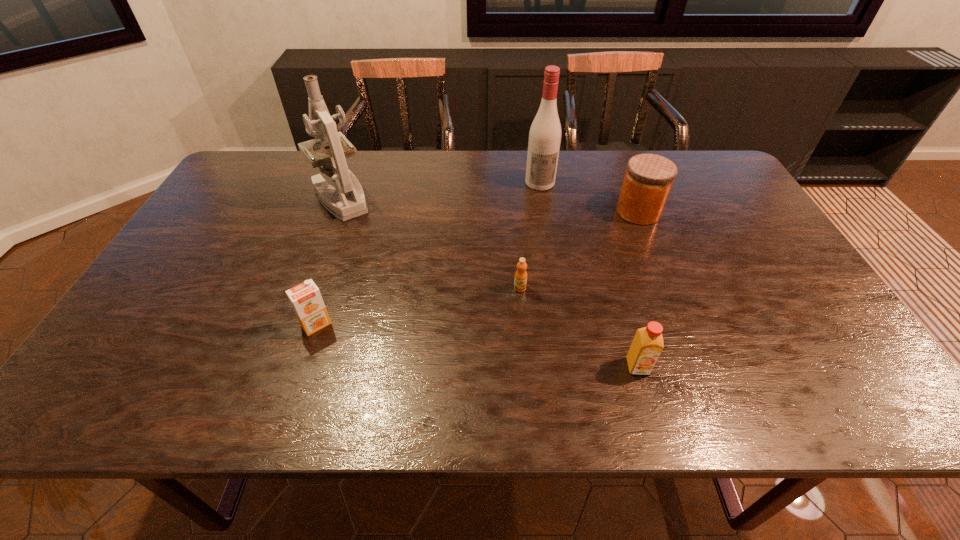
Locate an element on the screen. The width and height of the screenshot is (960, 540). microscope is located at coordinates click(x=347, y=200).

Image resolution: width=960 pixels, height=540 pixels. I want to click on alcohol, so click(545, 132).

Identify the location of the rightmost object. (648, 180).

Where is `the nearest orange juice`? the nearest orange juice is located at coordinates (647, 345).

You are a GUI agent. You are given a task and a screenshot of the screen. Output one action in this format:
    pyautogui.click(x=<x>, y=<y>)
    Task: Click on the rightmost orange juice
    This screenshot has width=960, height=540.
    Given the screenshot: What is the action you would take?
    coord(647,345)

At what (x,y) coordinates should I click in order to perform the action: click on the second nearest object. Please return your answer as a coordinate pair (x, y). Looking at the image, I should click on (305, 298).

Find the location of a particular element. This screenshot has height=540, width=960. the leftmost orange juice is located at coordinates (305, 298).

The height and width of the screenshot is (540, 960). Find the location of `the shortest object`. the shortest object is located at coordinates (520, 281).

This screenshot has height=540, width=960. Identify the location of the fourth farthest object. (520, 281).

Locate an element on the screen. vacant area located 0.320m on the right of the microscope is located at coordinates (476, 198).